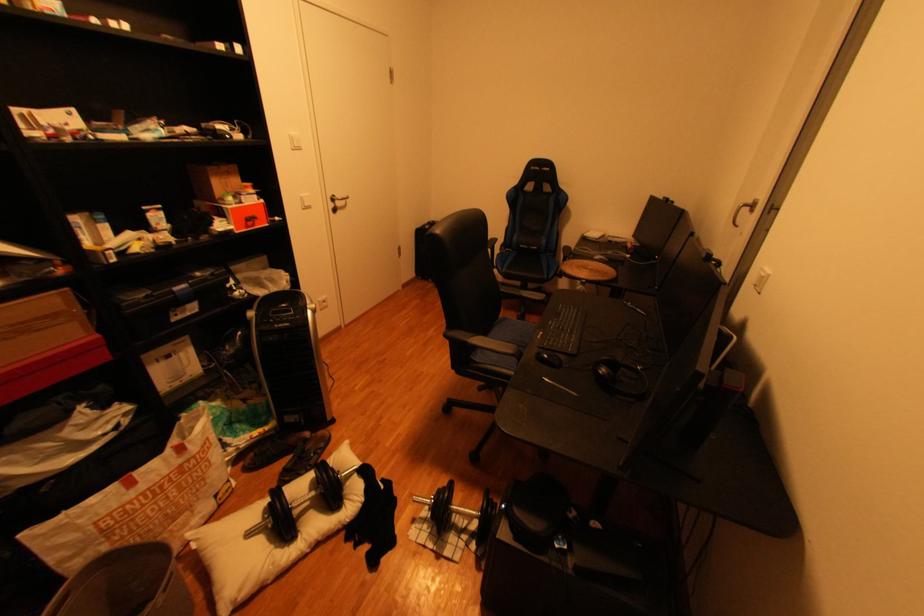
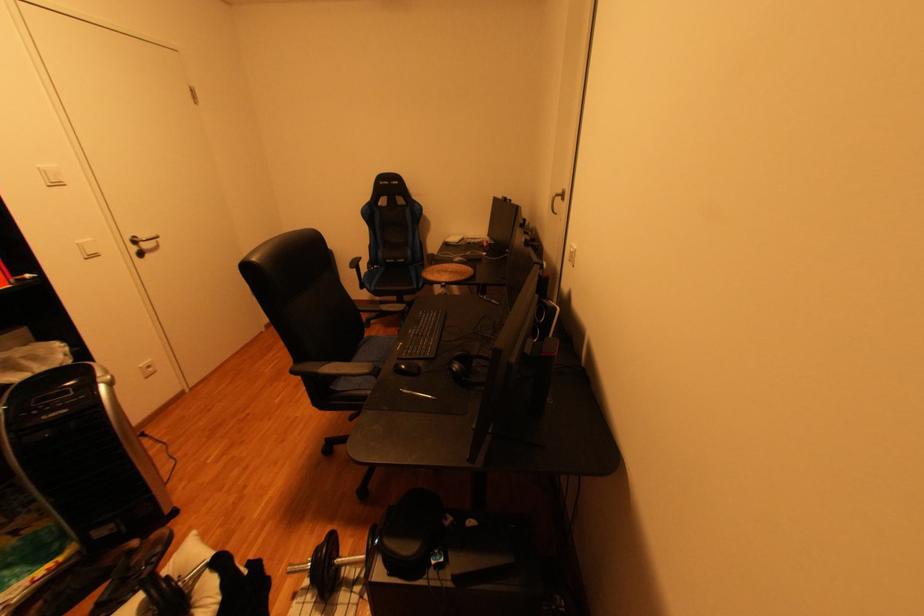
Where in the second image is the point corresponding to pixel 477 344 from the first image?

(325, 375)